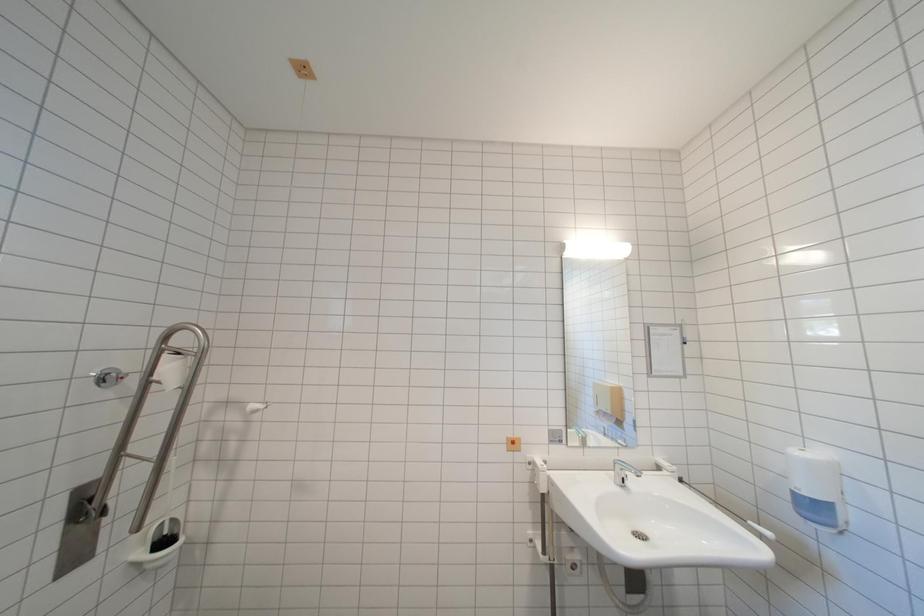
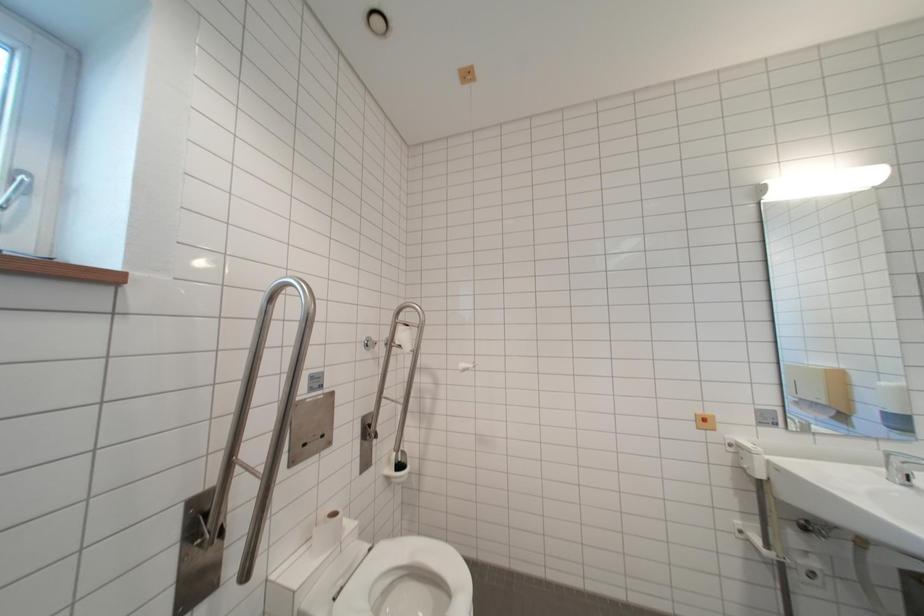
Question: The images are taken continuously from a first-person perspective. In which direction is your viewpoint rotating?

Choices:
 (A) Left
 (B) Right
 (C) Up
 (D) Down

Answer: (A)